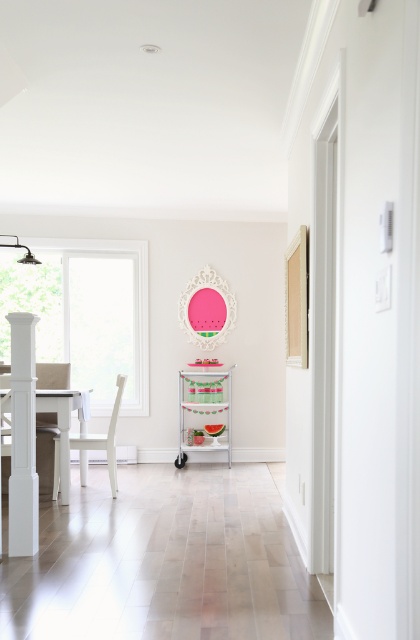
Question: Which object is closer to the camera taking this photo?

Choices:
 (A) white glossy table at left
 (B) white matte chair at left

Answer: (A)

Question: Which of the following is the farthest from the observer?

Choices:
 (A) (120, 378)
 (B) (67, 480)

Answer: (A)

Question: Does white glossy table at left appear on the right side of white matte chair at left?

Choices:
 (A) yes
 (B) no

Answer: (B)

Question: Which of the following is the closest to the observer?

Choices:
 (A) white matte chair at left
 (B) white glossy table at left

Answer: (B)

Question: Is white glossy table at left wider than white matte chair at left?

Choices:
 (A) no
 (B) yes

Answer: (A)

Question: Does white glossy table at left have a greater width compared to white matte chair at left?

Choices:
 (A) no
 (B) yes

Answer: (A)